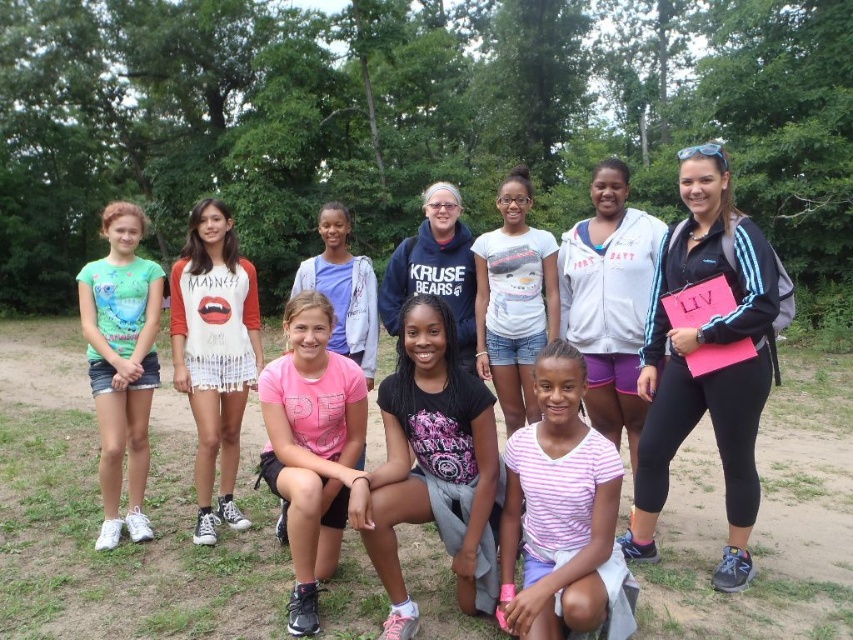
Can you confirm if black athletic wear at right is bigger than green matte t-shirt at left?

No, black athletic wear at right is not bigger than green matte t-shirt at left.

Between point (665, 266) and point (138, 355), which one is positioned behind?

Positioned behind is point (138, 355).

Is point (701, 289) positioned behind point (94, 365)?

No, it is not.

This screenshot has height=640, width=853. I want to click on black athletic wear at right, so click(x=708, y=355).

Which is in front, point (309, 440) or point (149, 372)?

Point (309, 440) is more forward.

Can you confirm if pink matte t-shirt at center is wider than green matte t-shirt at left?

Incorrect, pink matte t-shirt at center's width does not surpass green matte t-shirt at left's.

Identify the location of pink matte t-shirt at center. This screenshot has width=853, height=640. (311, 445).

Who is more forward, (425, 394) or (587, 544)?

Point (587, 544) is in front.

Does dark purple tie-dye shirt at center appear under pink striped shirt at lower center?

Incorrect, dark purple tie-dye shirt at center is not positioned below pink striped shirt at lower center.

Is point (474, 577) less distant than point (517, 616)?

No, it is not.

Locate an element on the screen. The width and height of the screenshot is (853, 640). dark purple tie-dye shirt at center is located at coordinates (432, 465).